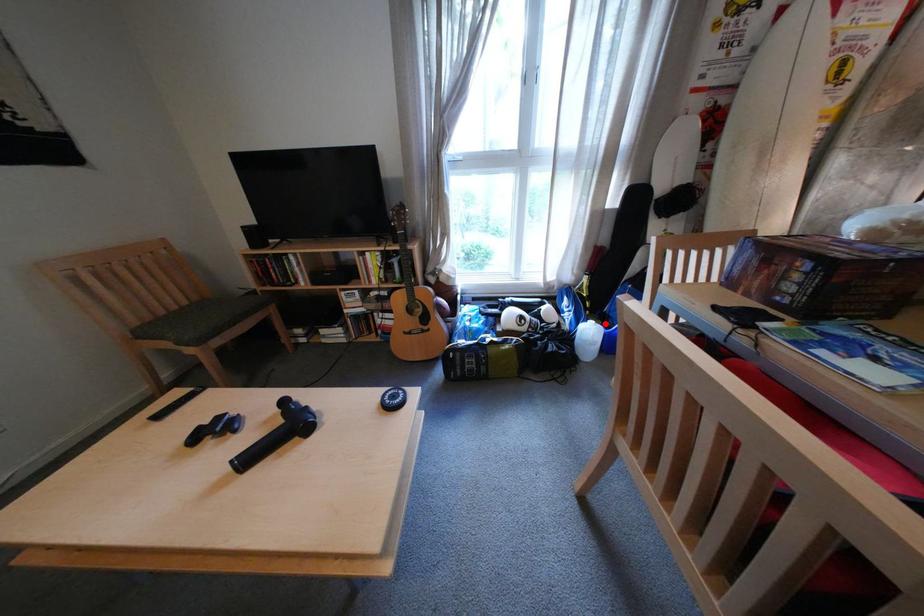
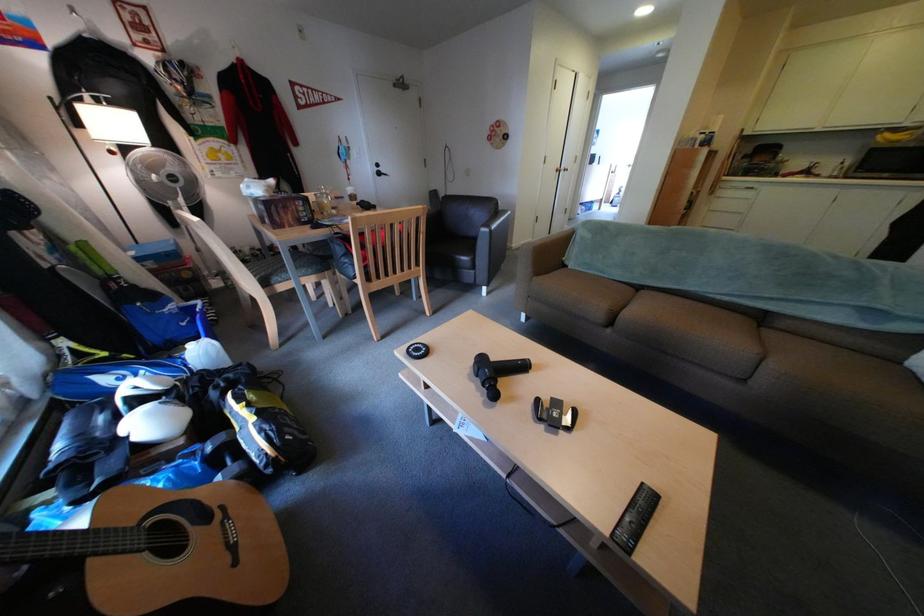
Locate, in the second image, the point that corresponds to the highlighted location in the first image.

(204, 347)